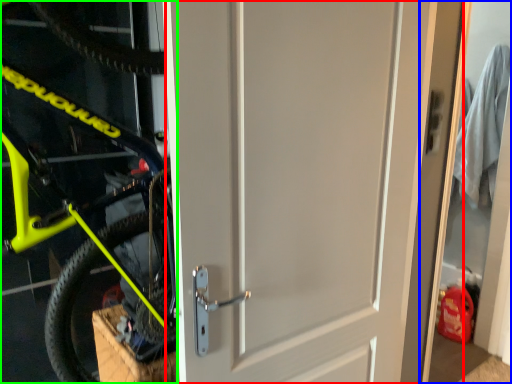
Question: Which object is the farthest from door (highlighted by a red box)? Choose among these: garage door (highlighted by a blue box) or bicycle (highlighted by a green box).

Choices:
 (A) garage door
 (B) bicycle

Answer: (A)